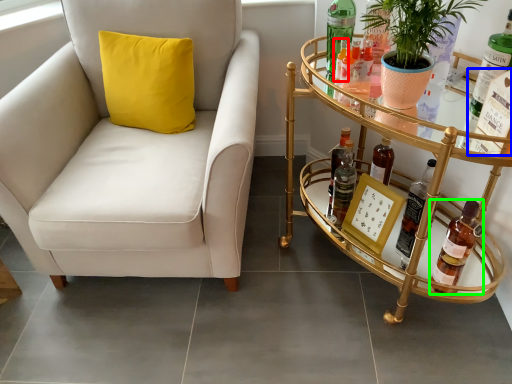
Question: Which object is the closest to the bottle (highlighted by a red box)? Choose among these: bottle (highlighted by a blue box) or bottle (highlighted by a green box).

Choices:
 (A) bottle
 (B) bottle

Answer: (A)